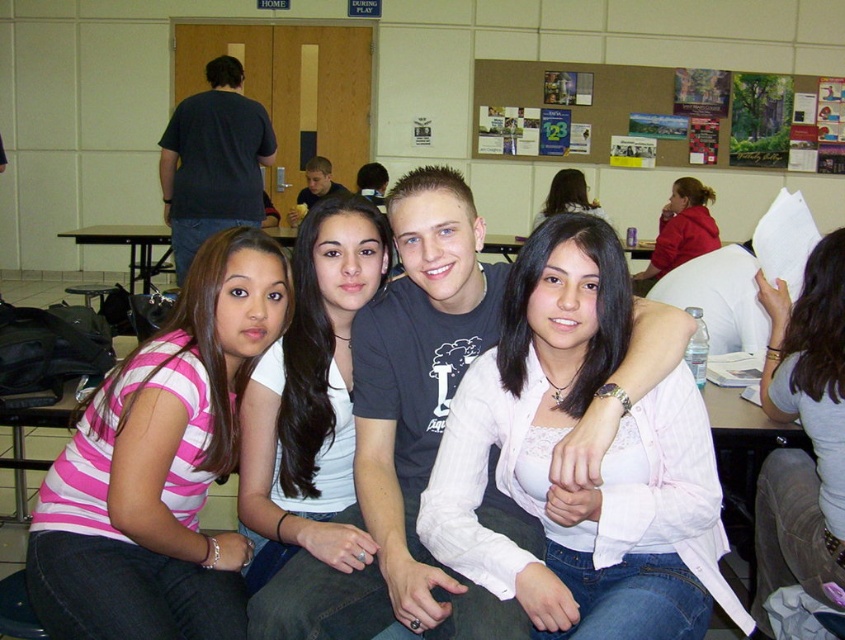
Between point (728, 72) and point (636, 291), which one is positioned behind?

Point (728, 72)

Which of these two, wooden corkboard at upper center or matte red hoodie at upper right, stands shorter?

Standing shorter between the two is matte red hoodie at upper right.

Does point (664, 156) come in front of point (701, 227)?

No, (664, 156) is further to viewer.

What are the coordinates of `wooden corkboard at upper center` in the screenshot? It's located at click(x=658, y=113).

Which of these two, pink striped shirt at lower left or wooden corkboard at upper center, stands taller?

wooden corkboard at upper center is taller.

What do you see at coordinates (161, 465) in the screenshot? I see `pink striped shirt at lower left` at bounding box center [161, 465].

This screenshot has height=640, width=845. I want to click on pink striped shirt at lower left, so click(x=161, y=465).

Between point (815, 465) and point (706, 252), which one is positioned behind?

Point (706, 252)

Measure the distance between point (803, 385) and camera.

Point (803, 385) and camera are 1.74 meters apart from each other.

Looking at this image, measure the distance between point (x=769, y=464) and camera.

1.98 meters

Locate an element on the screen. The image size is (845, 640). gray fabric pants at lower right is located at coordinates (805, 433).